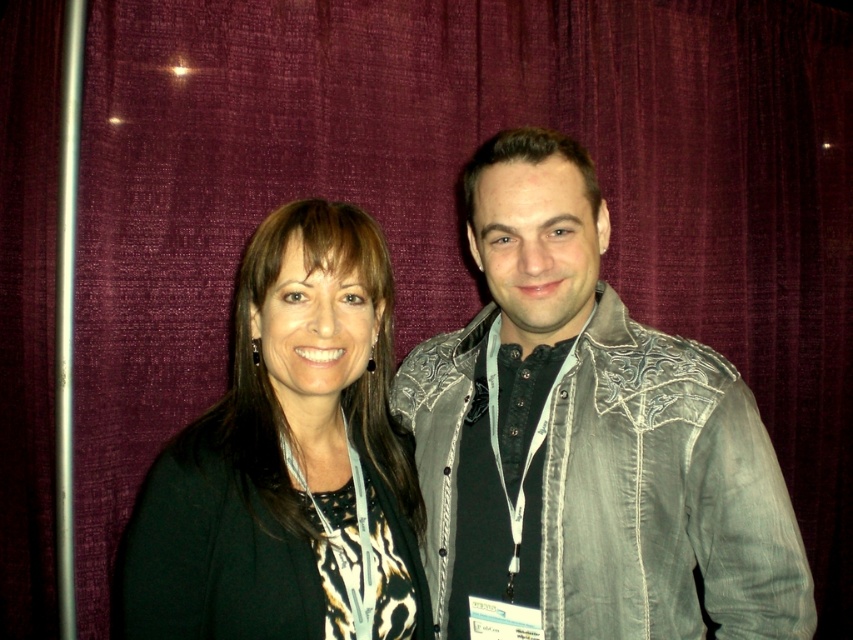
You are organizing a clothing display and need to arrange the denim jacket at center and the black matte jacket at center. According to the image, which jacket is placed on top of the other?

The denim jacket at center is positioned over black matte jacket at center, so it is placed on top.

You are a photographer trying to capture a clear shot of both the denim jacket at center and the black matte jacket at center. Which jacket will appear larger in your photo?

The denim jacket at center will appear larger in your photo because it is closer to the viewer than the black matte jacket at center.

You are organizing a clothing display and need to place the denim jacket at center and the black matte jacket at center side by side on a narrow shelf. Given that the shelf can only accommodate one of them, which jacket should you choose to fit better?

The black matte jacket at center has a smaller width compared to the denim jacket at center, so it will fit better on the narrow shelf.